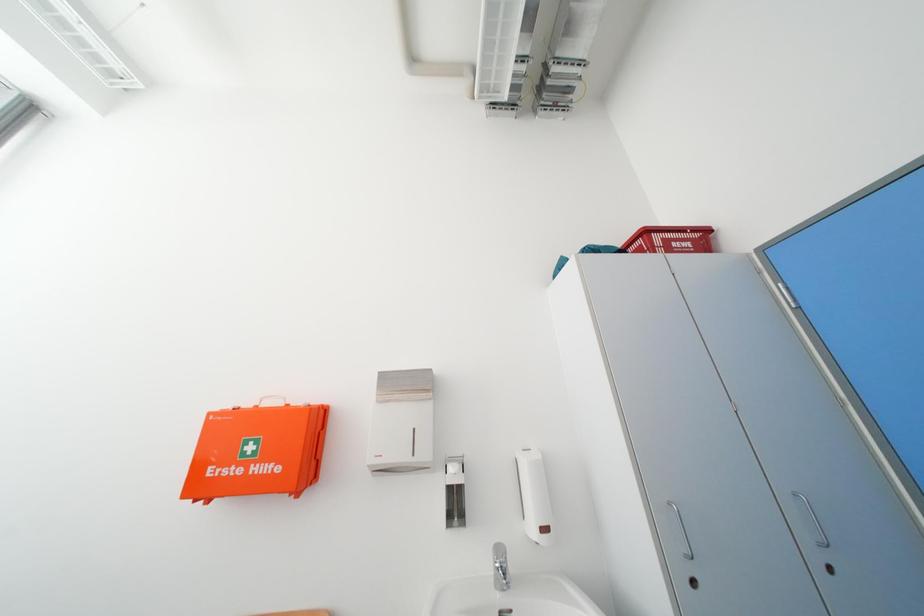
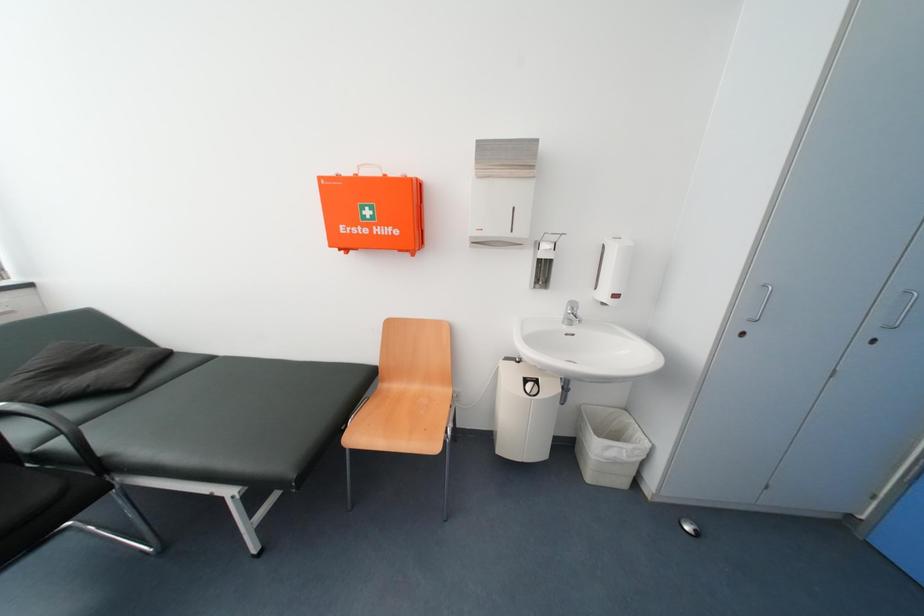
Question: How did the camera likely rotate?

Choices:
 (A) Left
 (B) Right
 (C) Up
 (D) Down

Answer: (D)